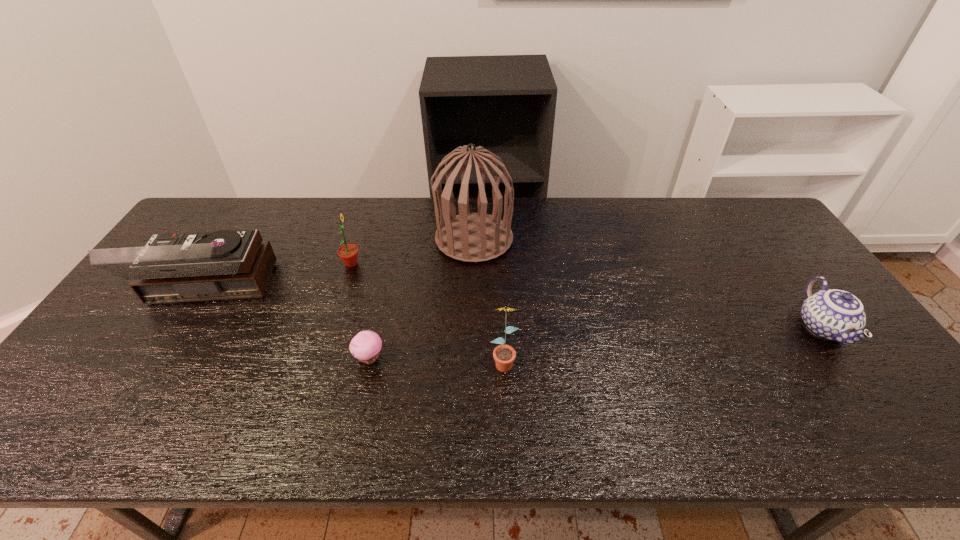
Identify the location of the tallest object. The width and height of the screenshot is (960, 540). (470, 237).

The width and height of the screenshot is (960, 540). I want to click on the leftmost object, so pyautogui.click(x=226, y=264).

Locate an element on the screen. the fifth shortest object is located at coordinates (226, 264).

You are a GUI agent. You are given a task and a screenshot of the screen. Output one action in this format:
    pyautogui.click(x=<x>, y=<y>)
    Task: Click on the farther sunflower
    
    Given the screenshot: What is the action you would take?
    click(x=348, y=253)

You are a GUI agent. You are given a task and a screenshot of the screen. Output one action in this format:
    pyautogui.click(x=<x>, y=<y>)
    Task: Click on the left sunflower
    This screenshot has height=540, width=960.
    Given the screenshot: What is the action you would take?
    pyautogui.click(x=348, y=253)

Locate an element on the screen. the nearer sunflower is located at coordinates (504, 355).

What are the coordinates of `the rightmost object` in the screenshot? It's located at (836, 315).

Where is `chinaware`? The image size is (960, 540). chinaware is located at coordinates click(836, 315).

At what (x,y) coordinates should I click in order to perform the action: click on the third object from left to right. Please return your answer as a coordinate pair (x, y). Looking at the image, I should click on (365, 346).

At what (x,y) coordinates should I click in order to perform the action: click on cupcake. Please return your answer as a coordinate pair (x, y). Looking at the image, I should click on (365, 346).